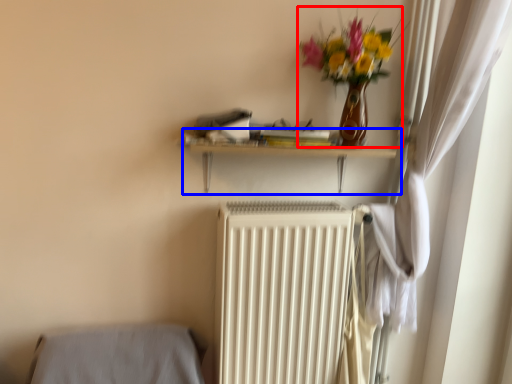
Question: Which point is closer to the camera, floral arrangement (highlighted by a red box) or shelf (highlighted by a blue box)?

Choices:
 (A) floral arrangement
 (B) shelf

Answer: (A)